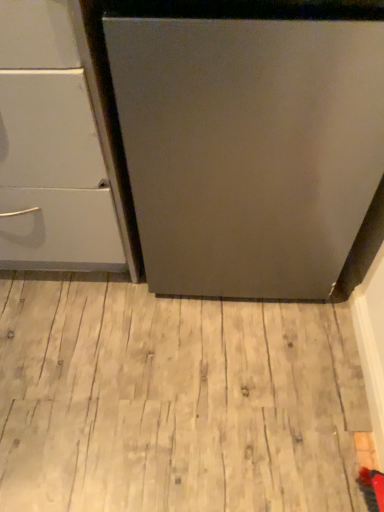
You are a GUI agent. You are given a task and a screenshot of the screen. Output one action in this format:
    pyautogui.click(x=<x>, y=<y>)
    Task: Click on the light wood flooring at center
    The image size is (384, 512).
    Given the screenshot: What is the action you would take?
    pyautogui.click(x=174, y=400)

Describe the element at coordinates (174, 400) in the screenshot. I see `light wood flooring at center` at that location.

Measure the distance between light wood flooring at center and camera.

The distance of light wood flooring at center from camera is 38.88 inches.

Image resolution: width=384 pixels, height=512 pixels. What do you see at coordinates (56, 147) in the screenshot?
I see `white glossy drawer at left` at bounding box center [56, 147].

At what (x,y) coordinates should I click in order to perform the action: click on white glossy drawer at left. Please return your answer as a coordinate pair (x, y). The height and width of the screenshot is (512, 384). Looking at the image, I should click on (56, 147).

Find the location of a particular element. light wood flooring at center is located at coordinates (174, 400).

Between white glossy drawer at left and light wood flooring at center, which one appears on the right side from the viewer's perspective?

Positioned to the right is light wood flooring at center.

Which object is further away from the camera taking this photo, white glossy drawer at left or light wood flooring at center?

Positioned behind is light wood flooring at center.

Does point (73, 265) come behind point (235, 395)?

Yes, it is.

From the image's perspective, which object appears higher, white glossy drawer at left or light wood flooring at center?

From the image's view, white glossy drawer at left is above.

From a real-world perspective, which object stands above the other?

white glossy drawer at left, from a real-world perspective.

Consider the image. Is white glossy drawer at left wider than light wood flooring at center?

In fact, white glossy drawer at left might be narrower than light wood flooring at center.

Considering the relative sizes of white glossy drawer at left and light wood flooring at center in the image provided, is white glossy drawer at left shorter than light wood flooring at center?

In fact, white glossy drawer at left may be taller than light wood flooring at center.

Who is bigger, white glossy drawer at left or light wood flooring at center?

With larger size is white glossy drawer at left.

Would you say white glossy drawer at left is inside or outside light wood flooring at center?

white glossy drawer at left is outside light wood flooring at center.

Does white glossy drawer at left touch light wood flooring at center?

No, white glossy drawer at left is not beside light wood flooring at center.

Is white glossy drawer at left aimed at light wood flooring at center?

No, white glossy drawer at left is not oriented towards light wood flooring at center.

What's the angular difference between white glossy drawer at left and light wood flooring at center's facing directions?

0.978 degrees.

Identify the location of chest of drawers above the light wood flooring at center (from the image's perspective). The image size is (384, 512). (56, 147).

Considering the relative positions of light wood flooring at center and white glossy drawer at left in the image provided, is light wood flooring at center to the right of white glossy drawer at left from the viewer's perspective?

Indeed, light wood flooring at center is positioned on the right side of white glossy drawer at left.

Considering the relative positions of light wood flooring at center and white glossy drawer at left in the image provided, is light wood flooring at center behind white glossy drawer at left?

That is True.

Is point (83, 315) more distant than point (95, 81)?

That is True.

Based on the photo, from the image's perspective, is light wood flooring at center above or below white glossy drawer at left?

From the image's perspective, light wood flooring at center appears below white glossy drawer at left.

From a real-world perspective, is light wood flooring at center located beneath white glossy drawer at left?

Yes.

Which object is wider, light wood flooring at center or white glossy drawer at left?

With larger width is light wood flooring at center.

In terms of height, does light wood flooring at center look taller or shorter compared to white glossy drawer at left?

light wood flooring at center is shorter than white glossy drawer at left.

Considering the sizes of light wood flooring at center and white glossy drawer at left in the image, is light wood flooring at center bigger or smaller than white glossy drawer at left?

Clearly, light wood flooring at center is smaller in size than white glossy drawer at left.

Is light wood flooring at center not within white glossy drawer at left?

Yes, light wood flooring at center is not within white glossy drawer at left.

From the picture: Are light wood flooring at center and white glossy drawer at left far apart?

They are positioned close to each other.

Is light wood flooring at center turned away from white glossy drawer at left?

No, light wood flooring at center is not facing away from white glossy drawer at left.

What's the angular difference between light wood flooring at center and white glossy drawer at left's facing directions?

The angular difference between light wood flooring at center and white glossy drawer at left is 0.978 degrees.

Locate an element on the screen. hardwood on the right of white glossy drawer at left is located at coordinates (174, 400).

You are a GUI agent. You are given a task and a screenshot of the screen. Output one action in this format:
    pyautogui.click(x=<x>, y=<y>)
    Task: Click on the hardwood beneath the white glossy drawer at left (from a real-world perspective)
    Image resolution: width=384 pixels, height=512 pixels.
    Given the screenshot: What is the action you would take?
    pyautogui.click(x=174, y=400)

Locate an element on the screen. The width and height of the screenshot is (384, 512). the chest of drawers that appears above the light wood flooring at center (from a real-world perspective) is located at coordinates (56, 147).